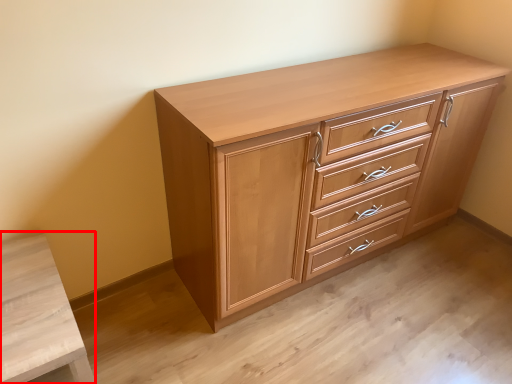
Question: From the image's perspective, where is vanity (annotated by the red box) located in relation to chest of drawers in the image?

Choices:
 (A) below
 (B) above

Answer: (A)